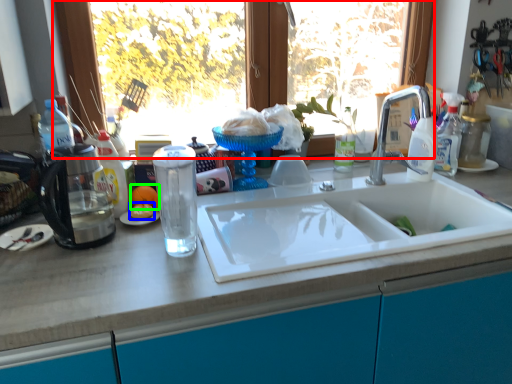
Question: Which is farther away from window (highlighted by a red box)? food (highlighted by a blue box) or orange (highlighted by a green box)?

Choices:
 (A) food
 (B) orange

Answer: (A)